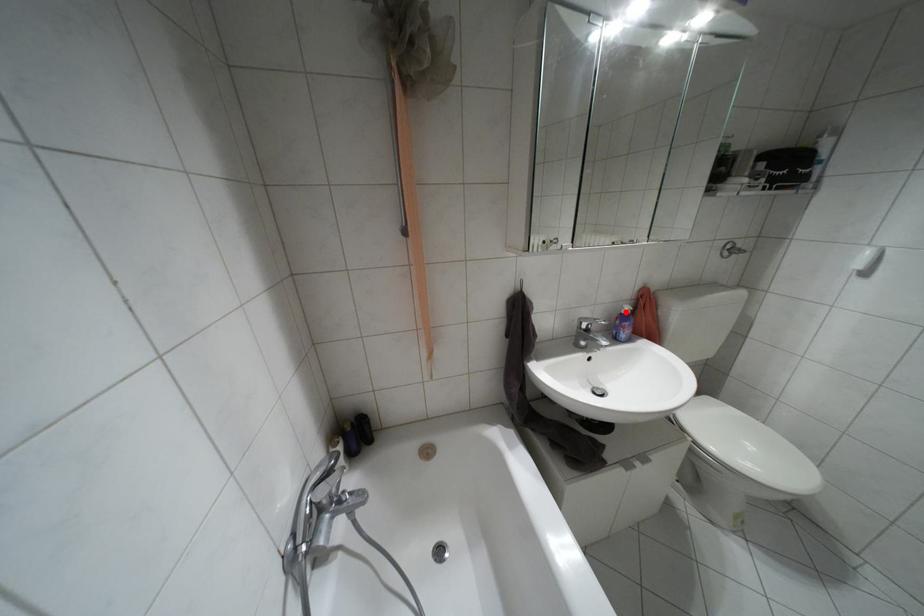
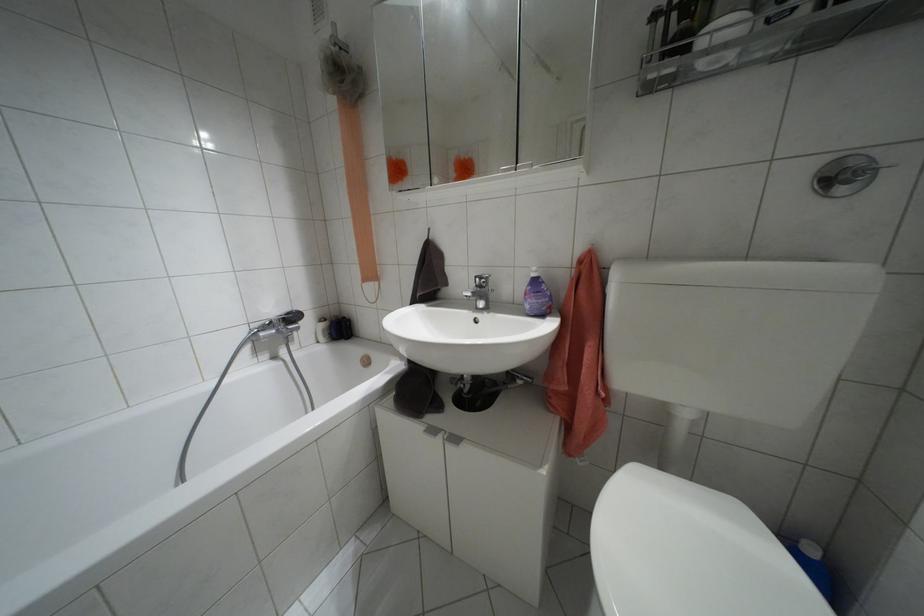
The point at the highlighted location is marked in the first image. Where is the corresponding point in the second image?

(532, 274)